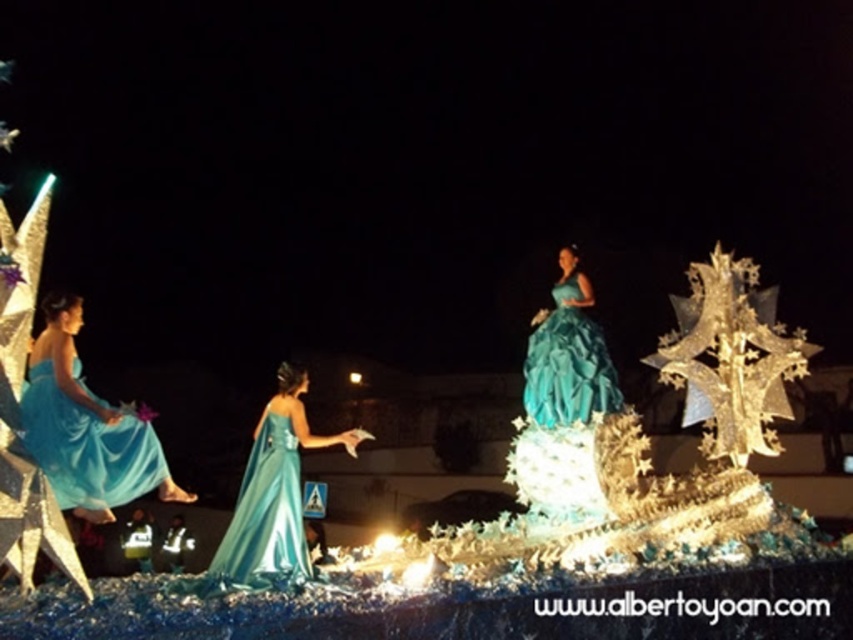
Is matte blue dress at left above satin teal gown at center?

Indeed, matte blue dress at left is positioned over satin teal gown at center.

Is matte blue dress at left shorter than satin teal gown at center?

Yes.

At what (x,y) coordinates should I click in order to perform the action: click on matte blue dress at left. Please return your answer as a coordinate pair (x, y). Looking at the image, I should click on (85, 428).

Does satin teal gown at center have a greater width compared to teal satin gown at center?

Yes, satin teal gown at center is wider than teal satin gown at center.

Who is shorter, satin teal gown at center or teal satin gown at center?

Standing shorter between the two is teal satin gown at center.

Is point (236, 550) closer to camera compared to point (572, 296)?

Yes, point (236, 550) is in front of point (572, 296).

The width and height of the screenshot is (853, 640). I want to click on satin teal gown at center, so click(x=273, y=496).

Looking at this image, can you confirm if matte blue dress at left is positioned below teal satin gown at center?

Yes.

Does matte blue dress at left appear on the right side of teal satin gown at center?

In fact, matte blue dress at left is to the left of teal satin gown at center.

Looking at this image, who is more distant from viewer, (55, 483) or (589, 337)?

Positioned behind is point (589, 337).

Locate an element on the screen. matte blue dress at left is located at coordinates (85, 428).